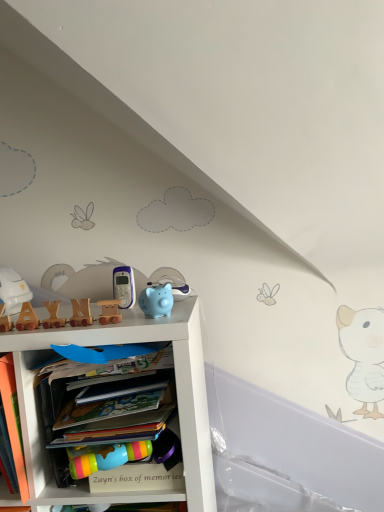
The image size is (384, 512). I want to click on free point to the right of wooden train at center, arranged as the fifth toy when viewed from the right, so click(115, 317).